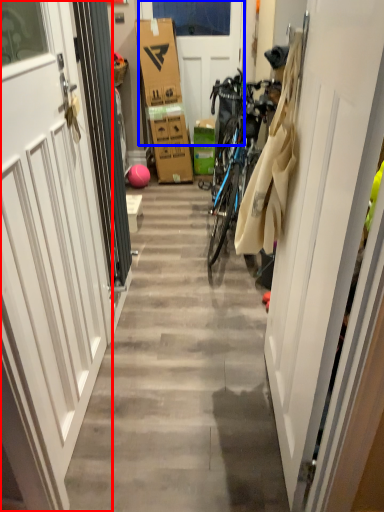
Question: Which object is closer to the camera taking this photo, door (highlighted by a red box) or door (highlighted by a blue box)?

Choices:
 (A) door
 (B) door

Answer: (A)